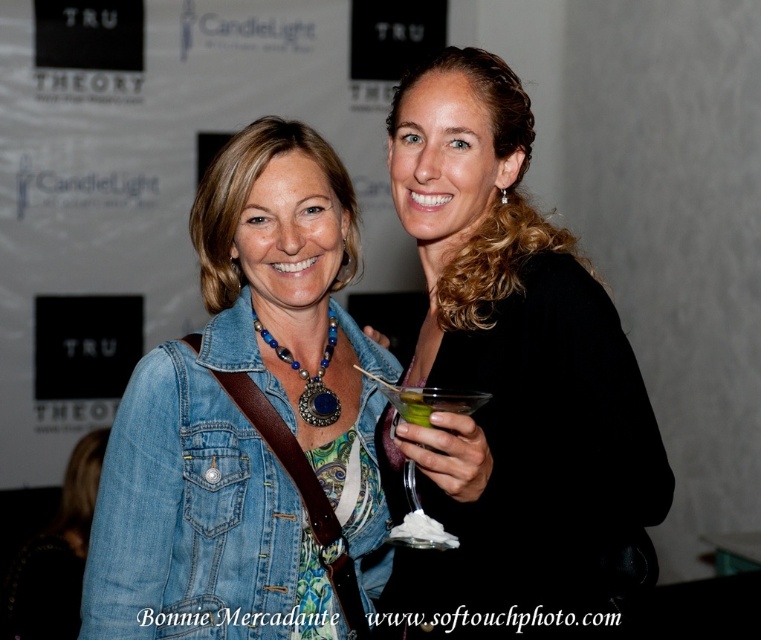
You are a photographer at an event and need to adjust your camera settings to focus on both the denim jacket at lower right and the green translucent glass at center. Given their height difference, which object will require you to adjust the focus to a higher plane?

The denim jacket at lower right is much taller than the green translucent glass at center, so you will need to adjust the focus to a higher plane to capture the denim jacket at lower right properly.

You are a photographer setting up for a photoshoot. You need to position a light source so that it illuminates the black matte dress at right without casting a shadow from the green translucent glass at center onto it. Based on their positions, can you achieve this?

The black matte dress at right is closer to the viewer than the green translucent glass at center, so placing the light source behind the green translucent glass at center would allow light to pass through it and illuminate the dress without casting a shadow.